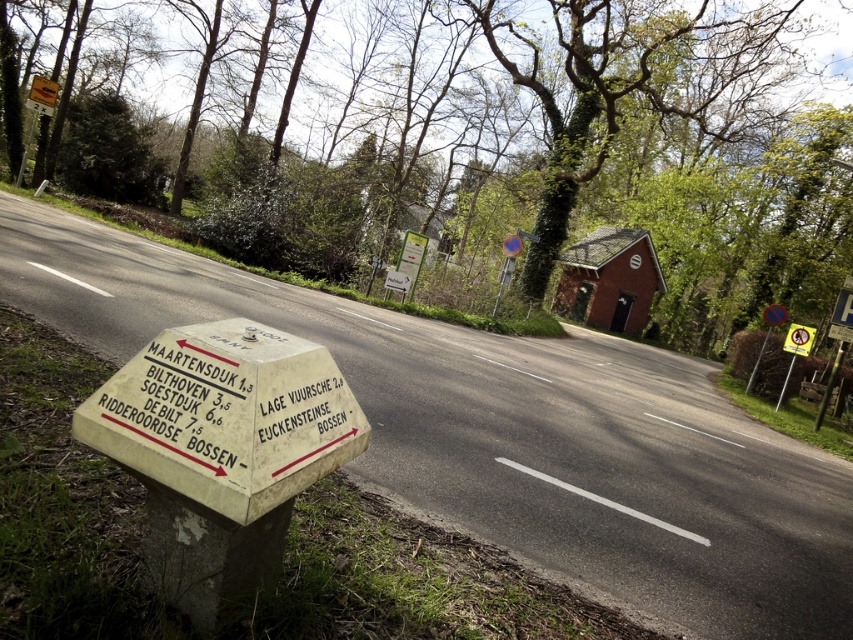
Can you confirm if green leafy tree at upper center is bigger than metallic reflective sign at upper right?

Correct, green leafy tree at upper center is larger in size than metallic reflective sign at upper right.

Between green leafy tree at upper center and metallic reflective sign at upper right, which one has more height?

Standing taller between the two is green leafy tree at upper center.

At what (x,y) coordinates should I click in order to perform the action: click on green leafy tree at upper center. Please return your answer as a coordinate pair (x, y). The image size is (853, 640). Looking at the image, I should click on (514, 147).

Where is `green leafy tree at upper center`? green leafy tree at upper center is located at coordinates (514, 147).

Which is more to the left, yellow plastic sign at center or green wooden signpost at lower right?

Positioned to the left is yellow plastic sign at center.

Is yellow plastic sign at center closer to camera compared to green wooden signpost at lower right?

That is False.

Identify the location of yellow plastic sign at center. click(x=799, y=339).

This screenshot has height=640, width=853. I want to click on yellow plastic sign at center, so click(799, 339).

Is metallic reflective sign at upper right to the left of yellow plastic sign at center from the viewer's perspective?

Incorrect, metallic reflective sign at upper right is not on the left side of yellow plastic sign at center.

Does metallic reflective sign at upper right appear under yellow plastic sign at center?

No, metallic reflective sign at upper right is not below yellow plastic sign at center.

The height and width of the screenshot is (640, 853). What are the coordinates of `metallic reflective sign at upper right` in the screenshot? It's located at (767, 333).

I want to click on metallic reflective sign at upper right, so click(767, 333).